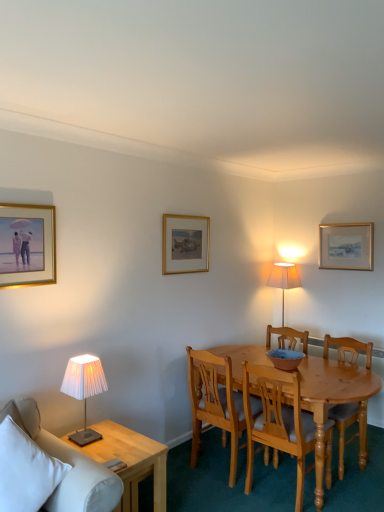
Question: Which direction should I rotate to look at gold/gilded picture frame at center, acting as the second picture frame starting from the front, — up or down?

Choices:
 (A) down
 (B) up

Answer: (B)

Question: Is wooden chair at center, the first chair positioned from the right, with white pleated fabric lampshade at left?

Choices:
 (A) no
 (B) yes

Answer: (A)

Question: Is wooden chair at center, which is the 3th chair from left to right, wider than white pleated fabric lampshade at left?

Choices:
 (A) no
 (B) yes

Answer: (B)

Question: From the image's perspective, is wooden chair at center, the first chair positioned from the right, over white pleated fabric lampshade at left?

Choices:
 (A) yes
 (B) no

Answer: (B)

Question: Is wooden chair at center, which is the 3th chair from left to right, oriented away from white pleated fabric lampshade at left?

Choices:
 (A) yes
 (B) no

Answer: (B)

Question: Is wooden chair at center, which is the 3th chair from left to right, not close to white pleated fabric lampshade at left?

Choices:
 (A) no
 (B) yes

Answer: (B)

Question: Considering the relative sizes of wooden chair at center, the first chair positioned from the right, and white pleated fabric lampshade at left in the image provided, is wooden chair at center, the first chair positioned from the right, thinner than white pleated fabric lampshade at left?

Choices:
 (A) no
 (B) yes

Answer: (A)

Question: Does gold-framed picture at upper right, which ranks as the first picture frame in right-to-left order, have a greater height compared to light wood side table at lower left?

Choices:
 (A) no
 (B) yes

Answer: (A)

Question: Is light wood side table at lower left a part of gold-framed picture at upper right, acting as the third picture frame starting from the front?

Choices:
 (A) no
 (B) yes

Answer: (A)

Question: Does gold-framed picture at upper right, acting as the third picture frame starting from the front, appear on the right side of light wood side table at lower left?

Choices:
 (A) yes
 (B) no

Answer: (A)

Question: Is gold-framed picture at upper right, the first picture frame in the back-to-front sequence, smaller than light wood side table at lower left?

Choices:
 (A) no
 (B) yes

Answer: (B)

Question: Is gold-framed picture at upper right, which ranks as the first picture frame in right-to-left order, shorter than light wood side table at lower left?

Choices:
 (A) yes
 (B) no

Answer: (A)

Question: From a real-world perspective, is gold-framed picture at upper right, positioned as the 3th picture frame in left-to-right order, over light wood side table at lower left?

Choices:
 (A) no
 (B) yes

Answer: (B)

Question: From a real-world perspective, does light wood side table at lower left stand above wooden chair at center, the first chair positioned from the right?

Choices:
 (A) no
 (B) yes

Answer: (A)